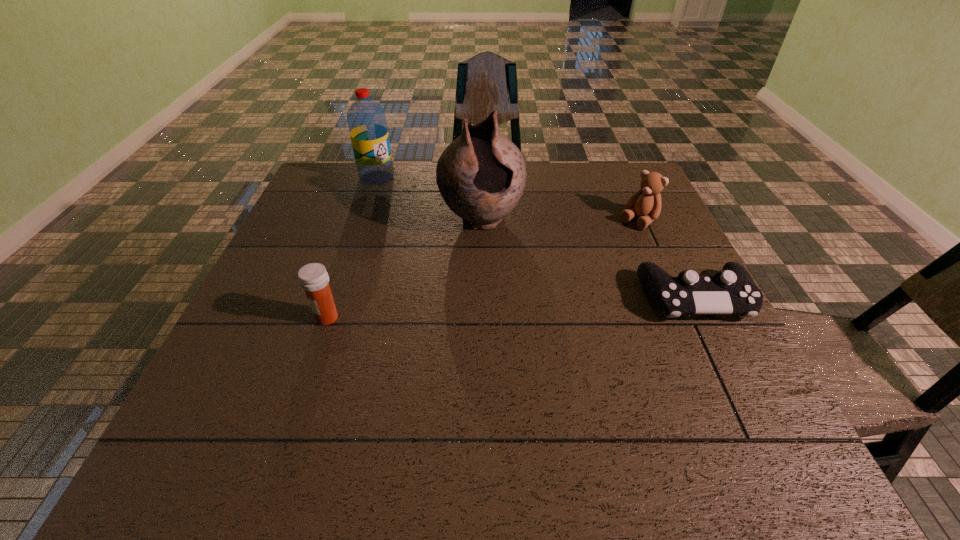
This screenshot has width=960, height=540. Identify the location of free space between the pottery and the farthest object. (429, 199).

Where is `unoccupied area between the teddy bear and the third object from left to right`? Image resolution: width=960 pixels, height=540 pixels. unoccupied area between the teddy bear and the third object from left to right is located at coordinates (560, 220).

At what (x,y) coordinates should I click in order to perform the action: click on object that is the second closest to the teddy bear. Please return your answer as a coordinate pair (x, y). Looking at the image, I should click on (481, 175).

You are a GUI agent. You are given a task and a screenshot of the screen. Output one action in this format:
    pyautogui.click(x=<x>, y=<y>)
    Task: Click on the object that can be found as the closest to the medicine
    
    Given the screenshot: What is the action you would take?
    pyautogui.click(x=481, y=175)

Where is `vacant position in the image that satisfies the following two spatial constraints: 1. on the front side of the teddy bear; 2. on the right side of the farthest object`? vacant position in the image that satisfies the following two spatial constraints: 1. on the front side of the teddy bear; 2. on the right side of the farthest object is located at coordinates (363, 221).

Find the location of a particular element. free point that satisfies the following two spatial constraints: 1. on the front side of the fourth shortest object; 2. on the right side of the pottery is located at coordinates (363, 220).